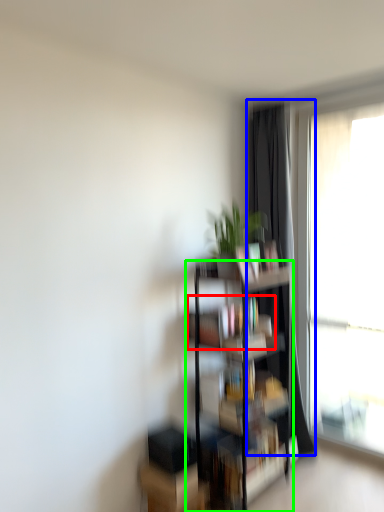
Question: Which is nearer to the book (highlighted by a red box)? curtain (highlighted by a blue box) or shelf (highlighted by a green box).

Choices:
 (A) curtain
 (B) shelf

Answer: (B)